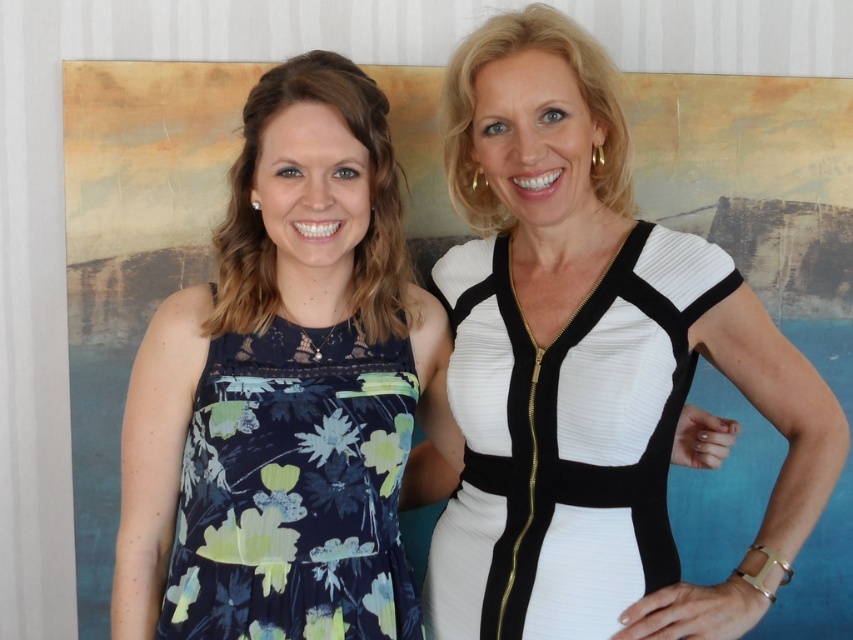
Consider the image. Can you confirm if white matte dress at center is wider than floral dress at left?

Yes.

Does white matte dress at center come behind floral dress at left?

Yes, it is behind floral dress at left.

Which is in front, point (618, 508) or point (219, 605)?

Point (219, 605) is more forward.

This screenshot has width=853, height=640. Find the location of `white matte dress at center`. white matte dress at center is located at coordinates (590, 365).

Which is behind, point (815, 520) or point (482, 506)?

The point (482, 506) is behind.

Between white matte dress at center and white textured dress at center, which one is positioned higher?

white matte dress at center

Identify the location of white matte dress at center. (590, 365).

Can you confirm if white textured dress at center is taller than floral-patterned fabric dress at left?

Yes, white textured dress at center is taller than floral-patterned fabric dress at left.

Identify the location of white textured dress at center. The height and width of the screenshot is (640, 853). (564, 440).